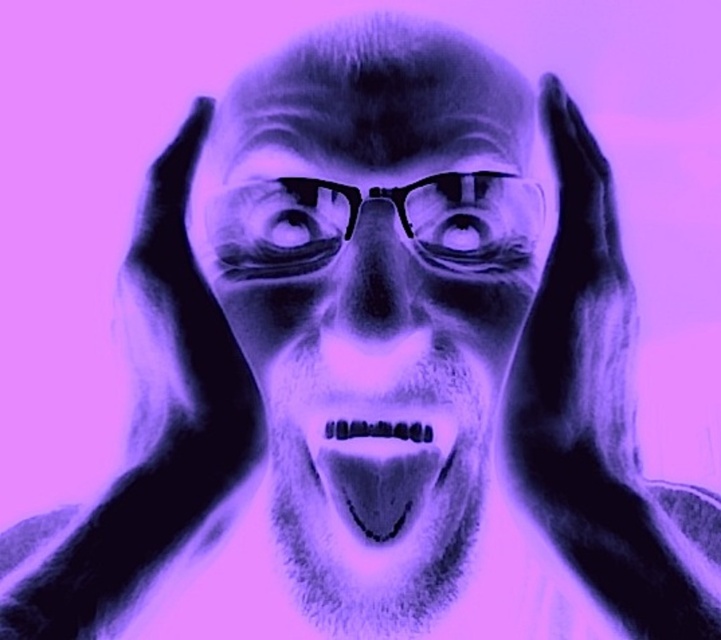
You are designing a digital avatar for a virtual assistant. The avatar must have a translucent purple face and mouth. The face and mouth must be positioned so that they are exactly 2 inches apart to meet the design specifications. Based on the image provided, will the current positioning of the translucent purple face at center and translucent purple mouth at center meet the design requirements?

The translucent purple face at center is 1.99 inches from the translucent purple mouth at center, which is just 0.01 inches less than the required 2 inches. This slight difference may not be noticeable to most users and could potentially meet the design specifications depending on tolerance levels, but strictly speaking, it falls short of the exact 2 inch requirement.

You are an artist analyzing the image. You notice the translucent purple face at center and the translucent purple mouth at center. Which one appears closer to you?

The translucent purple face at center is closer to the viewer than the translucent purple mouth at center.